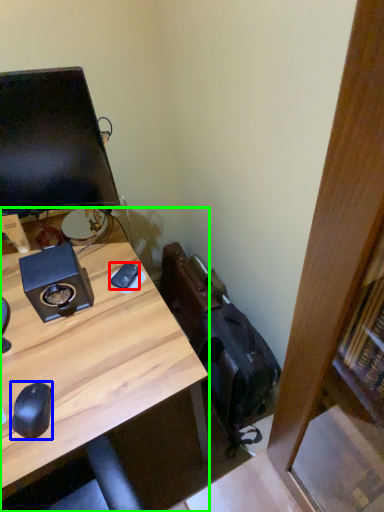
Question: Which object is the closest to the mouse (highlighted by a red box)? Choose among these: mouse (highlighted by a blue box) or desk (highlighted by a green box).

Choices:
 (A) mouse
 (B) desk

Answer: (B)